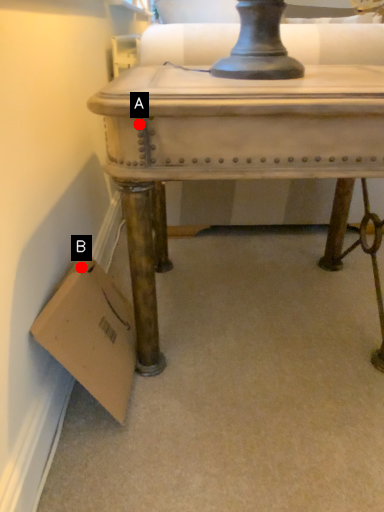
Question: Two points are circled on the image, labeled by A and B beside each circle. Which point is farther from the camera taking this photo?

Choices:
 (A) A is further
 (B) B is further

Answer: (B)